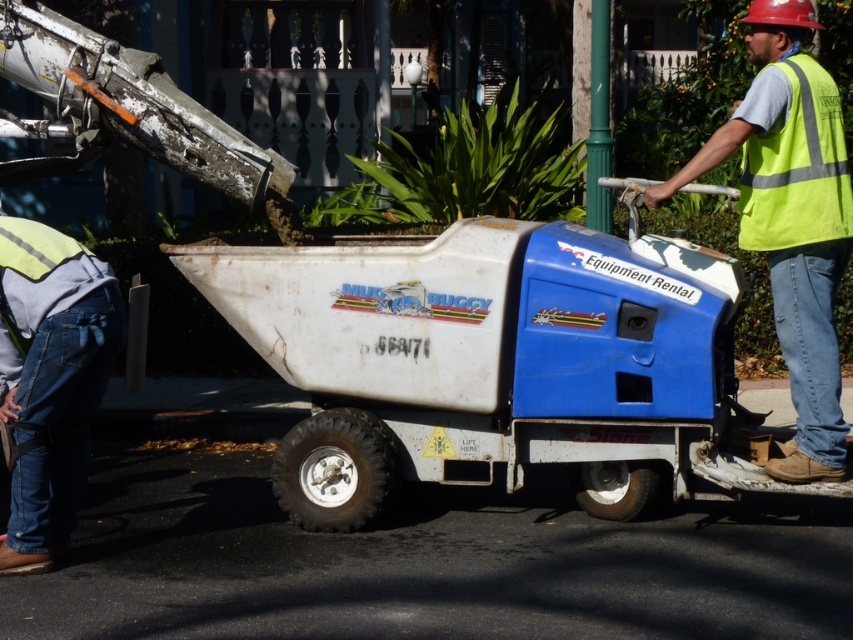
Question: Which of the following is the farthest from the observer?

Choices:
 (A) denim jeans at lower left
 (B) white matte/rough muck buggy at center

Answer: (B)

Question: Can you confirm if white matte/rough muck buggy at center is wider than reflective yellow vest at right?

Choices:
 (A) yes
 (B) no

Answer: (A)

Question: Which object appears farthest from the camera in this image?

Choices:
 (A) reflective yellow vest at right
 (B) denim jeans at lower left
 (C) white matte/rough muck buggy at center

Answer: (C)

Question: Is white matte/rough muck buggy at center behind denim jeans at lower left?

Choices:
 (A) no
 (B) yes

Answer: (B)

Question: Which is nearer to the denim jeans at lower left?

Choices:
 (A) reflective yellow vest at right
 (B) white matte/rough muck buggy at center

Answer: (B)

Question: Is white matte/rough muck buggy at center further to camera compared to reflective yellow vest at right?

Choices:
 (A) yes
 (B) no

Answer: (A)